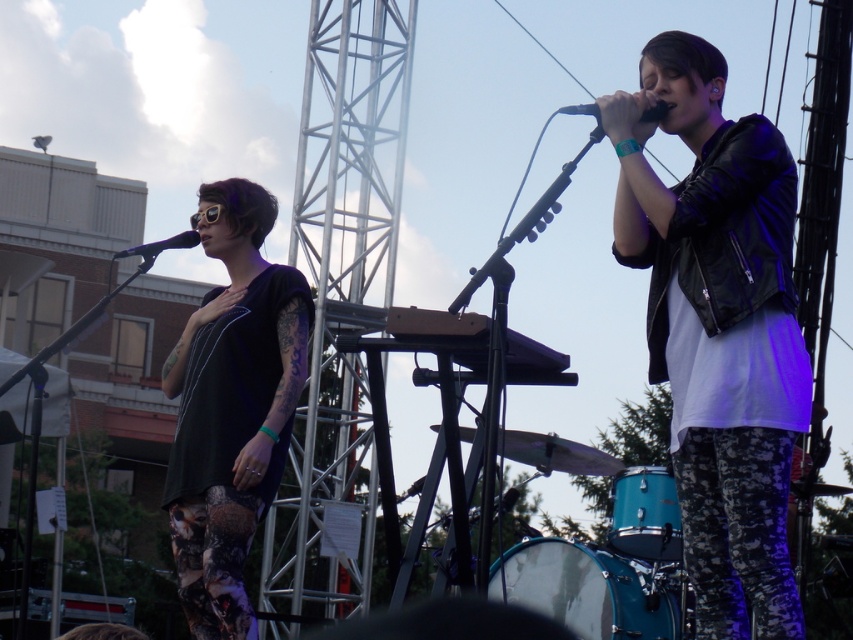
You are a photographer at the event and want to capture the leather jacket at upper right in your shot. What are the coordinates where you should focus your camera?

The leather jacket at upper right is located at coordinates point [718,328] so you should focus your camera there.

You are a photographer at the event and want to capture a closeup of the black matte shirt at left. The focus point of your camera is currently set to point (231, 406). Will this point be effective for focusing on the black matte shirt at left?

Yes, the point (231, 406) is on the black matte shirt at left, so it will be effective for focusing on it.